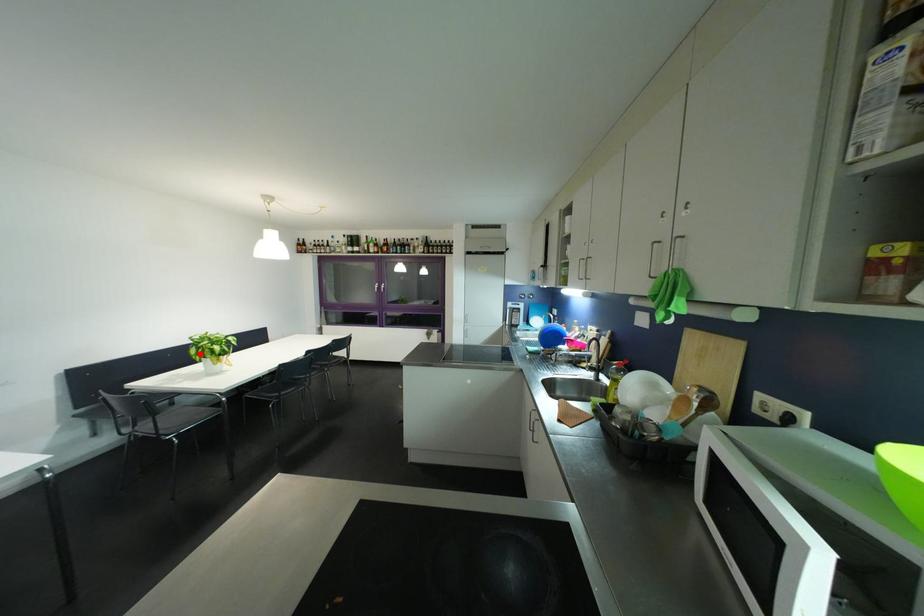
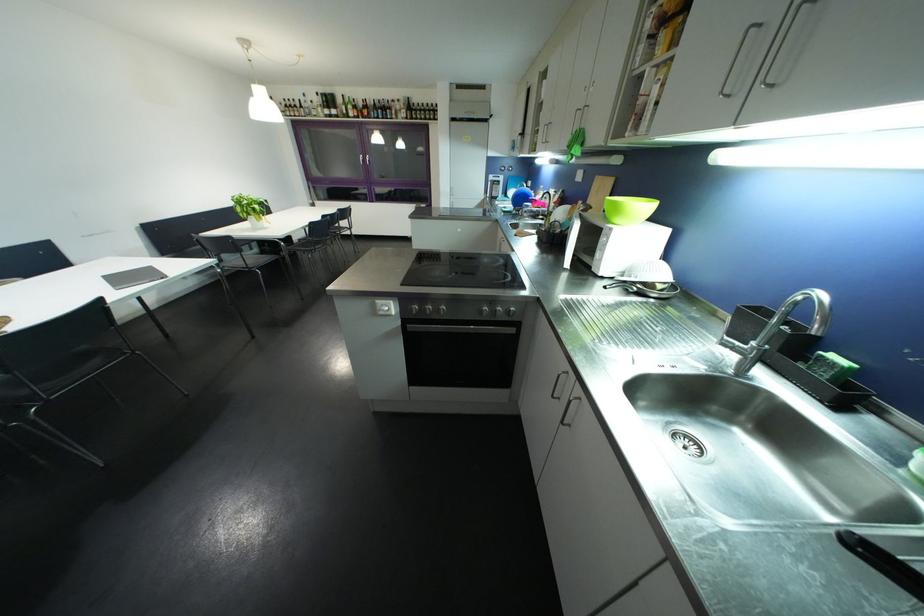
Question: I am providing you with two images of the same scene from different viewpoints. In image1, a red point is highlighted. Considering the same 3D point in image2, which of the following is correct?

Choices:
 (A) It is closer
 (B) It is farther

Answer: (A)